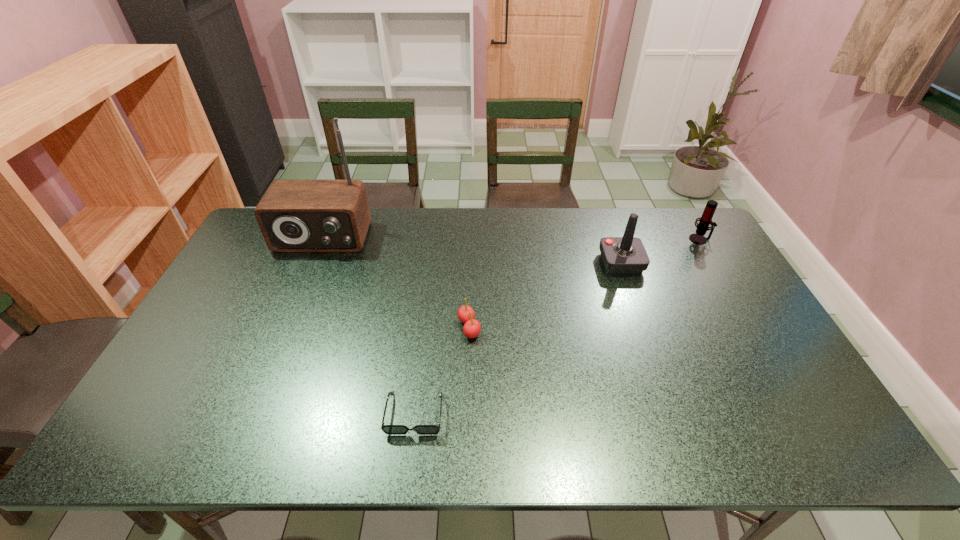
Find the location of a particular element. vacant space located on the front-facing side of the radio receiver is located at coordinates (280, 338).

Identify the location of vacant space located 0.190m on the back of the second tallest object. This screenshot has width=960, height=540. (605, 217).

This screenshot has height=540, width=960. Identify the location of free space located 0.270m on the front of the microphone. pos(735,301).

The height and width of the screenshot is (540, 960). I want to click on vacant area situated 0.100m on the left of the third object from left to right, so click(421, 328).

Find the location of a particular element. radio receiver that is at the far edge is located at coordinates (294, 215).

This screenshot has height=540, width=960. In order to click on microphone at the far edge in this screenshot , I will do `click(705, 220)`.

Where is `object present at the near edge`? The image size is (960, 540). object present at the near edge is located at coordinates (387, 429).

Where is `object present at the left edge`? This screenshot has height=540, width=960. object present at the left edge is located at coordinates (294, 215).

Identify the location of object present at the right edge. The image size is (960, 540). (705, 220).

Identify the location of object that is at the far left corner. This screenshot has width=960, height=540. (294, 215).